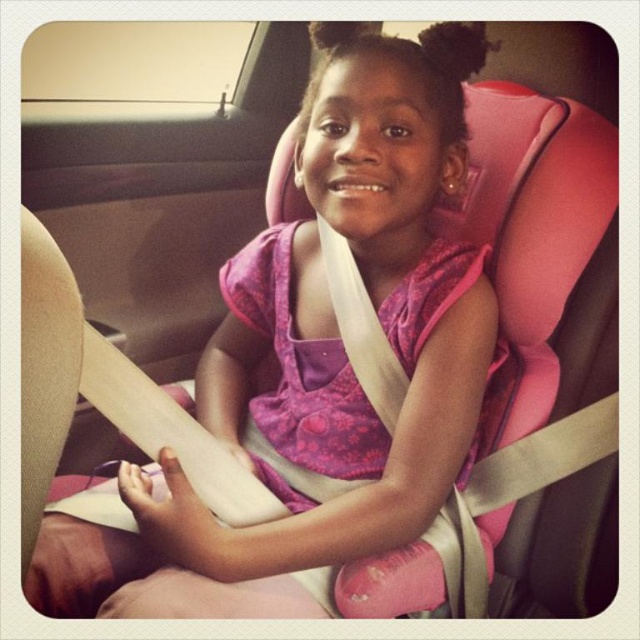
Who is more distant from viewer, (332, 180) or (392, 429)?

Point (392, 429)

The image size is (640, 640). Describe the element at coordinates (316, 364) in the screenshot. I see `pink fabric dress at center` at that location.

Where is `pink fabric dress at center`? Image resolution: width=640 pixels, height=640 pixels. pink fabric dress at center is located at coordinates (316, 364).